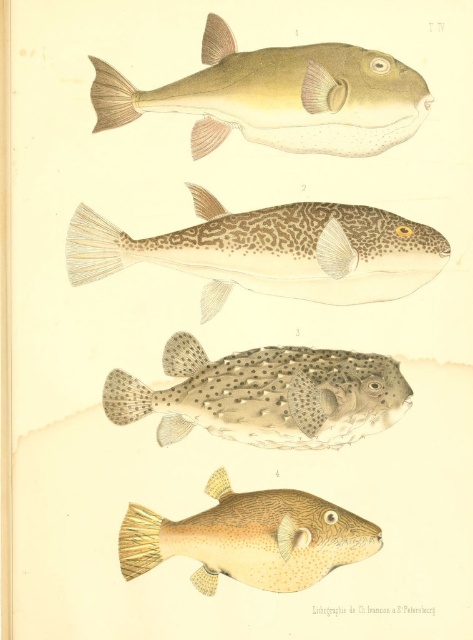
You are an underwater photographer who needs to capture both the matte green fish at upper center and the brown textured fish at bottom right in the same frame. Given that your camera has a maximum focus range of 25 inches, will you be able to include both fish in a single photo without moving your position?

The matte green fish at upper center is 27.71 inches away from the brown textured fish at bottom right. Since the distance between them exceeds the camera maximum focus range of 25 inches, you cannot include both in a single photo without moving your position.

In the image of the fish illustration, there are two fish labeled as the speckled leather pufferfish at center and the matte green fish at upper center. Which of these two fish is located higher up in the image?

The matte green fish at upper center is positioned higher up in the image compared to the speckled leather pufferfish at center, which is situated underneath it.